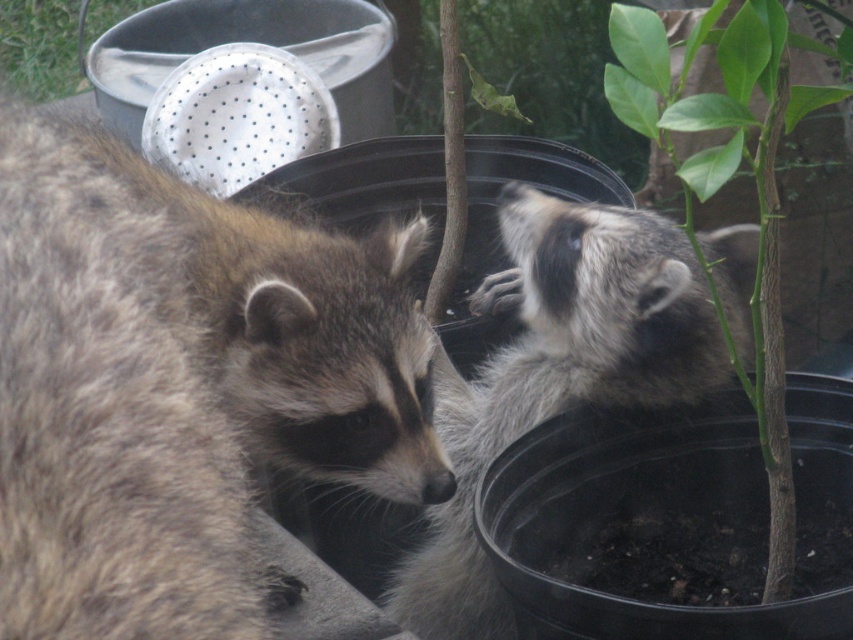
Who is positioned more to the left, fuzzy brown raccoon at left or fuzzy gray raccoon at center?

fuzzy brown raccoon at left

Who is more distant from viewer, (392, 403) or (525, 396)?

The point (525, 396) is behind.

This screenshot has height=640, width=853. I want to click on fuzzy brown raccoon at left, so click(x=106, y=416).

Between fuzzy gray raccoon at center and metallic silver colander at upper left, which one appears on the right side from the viewer's perspective?

Positioned to the right is fuzzy gray raccoon at center.

Is point (434, 538) farther from viewer compared to point (86, 16)?

No.

Where is `fuzzy gray raccoon at center`? The image size is (853, 640). fuzzy gray raccoon at center is located at coordinates (555, 372).

You are a GUI agent. You are given a task and a screenshot of the screen. Output one action in this format:
    pyautogui.click(x=<x>, y=<y>)
    Task: Click on the fuzzy brown raccoon at left
    The width and height of the screenshot is (853, 640).
    Given the screenshot: What is the action you would take?
    pyautogui.click(x=106, y=416)

Where is `fuzzy brown raccoon at left`? fuzzy brown raccoon at left is located at coordinates (106, 416).

Where is `fuzzy brown raccoon at left`? The width and height of the screenshot is (853, 640). fuzzy brown raccoon at left is located at coordinates (106, 416).